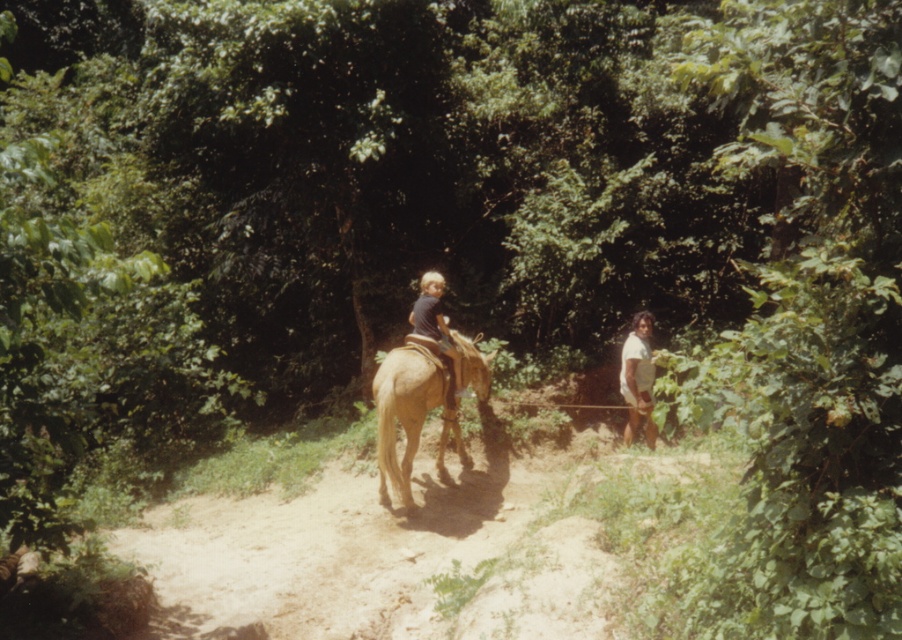
You are a hiker on the dirt path in the forest and see two horses. One is the light brown smooth horse at center and the other is the light brown horse at center. Which horse is larger?

The light brown smooth horse at center is bigger than the light brown horse at center.

You are a hiker on the dirt path in the forest scene. You see two points marked on your map. The first point is at coordinates point [398,349] and the second point is at point [451,358]. If you are facing along the path towards the right, which point is closer to you?

Point [398,349] is in front of point [451,358], so if you are facing along the path towards the right, point [398,349] is closer to you.

You are a hiker standing at the point labeled point (389, 387) and want to reach the point labeled point (646, 371). Which direction should you move to get closer to your destination?

Since point (389, 387) is closer to the viewer than point (646, 371), you should move forward towards the direction away from the viewer to reach your destination.